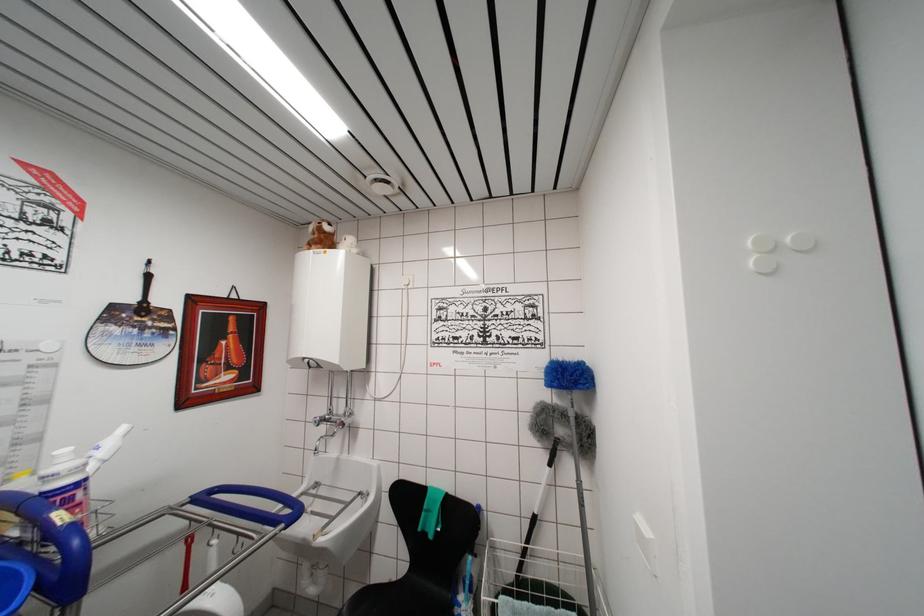
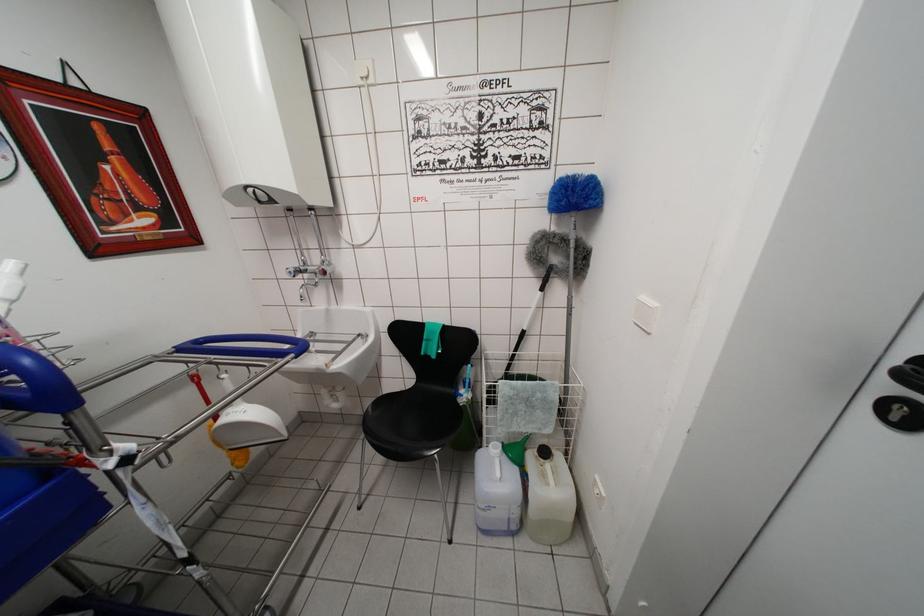
The point at (x=76, y=529) is marked in the first image. Where is the corresponding point in the second image?

(5, 349)